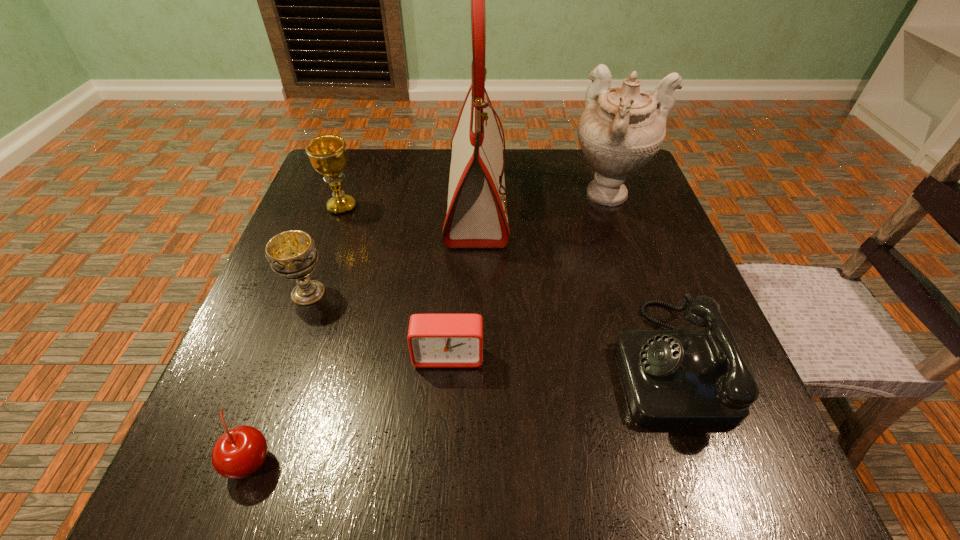
Image resolution: width=960 pixels, height=540 pixels. I want to click on vacant area located on the right of the farther chalice, so click(x=423, y=207).

I want to click on vacant region located 0.200m on the dial of the telephone, so click(499, 361).

Where is `free space located 0.160m on the dial of the telephone`? The image size is (960, 540). free space located 0.160m on the dial of the telephone is located at coordinates (522, 361).

The height and width of the screenshot is (540, 960). I want to click on free space located on the dial of the telephone, so click(x=381, y=361).

Locate an element on the screen. Image resolution: width=960 pixels, height=540 pixels. blank space located on the front of the shorter chalice is located at coordinates (269, 402).

I want to click on vacant space located on the front-facing side of the alarm clock, so [446, 397].

The image size is (960, 540). Find the location of `vacant space situated on the back of the cherry`. vacant space situated on the back of the cherry is located at coordinates (276, 393).

Identify the location of handbag present at the far edge. (477, 217).

The height and width of the screenshot is (540, 960). Identify the location of urn that is positioned at the far edge. (621, 129).

You are a GUI agent. You are given a task and a screenshot of the screen. Output one action in this format:
    pyautogui.click(x=<x>, y=<y>)
    Task: Click on the chalice situated at the far edge
    The image size is (960, 540).
    Given the screenshot: What is the action you would take?
    pyautogui.click(x=327, y=153)